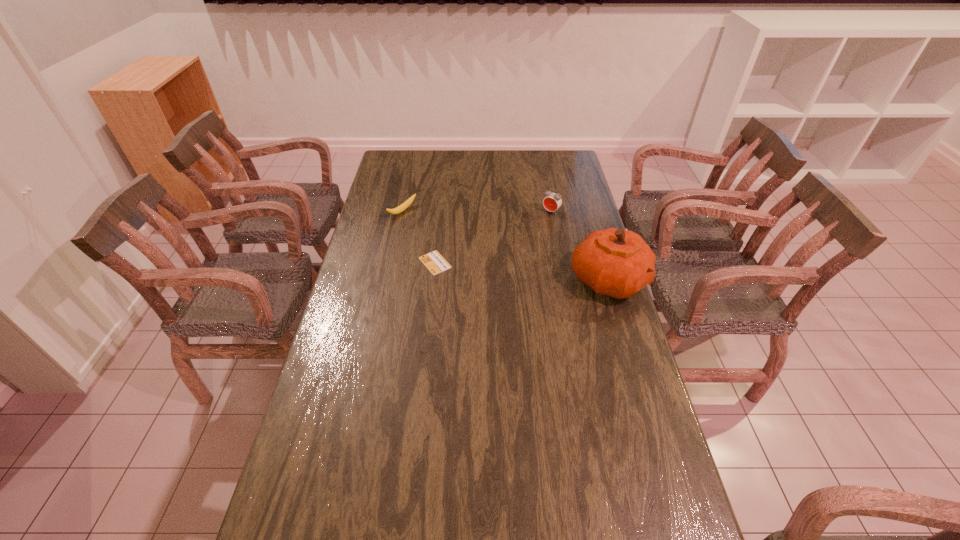
I want to click on object that is the closest one to the pumpkin, so click(x=552, y=201).

Locate an element on the screen. vacant area that satisfies the following two spatial constraints: 1. on the back side of the second object from left to right; 2. on the left side of the alarm clock is located at coordinates (441, 212).

Locate an element on the screen. This screenshot has height=540, width=960. vacant area in the image that satisfies the following two spatial constraints: 1. on the front side of the leftmost object; 2. on the front-facing side of the pumpkin is located at coordinates (387, 280).

At what (x,y) coordinates should I click in order to perform the action: click on vacant space that satisfies the following two spatial constraints: 1. on the front side of the pumpkin; 2. on the front-facing side of the banana. Please return your answer as a coordinate pair (x, y). The image size is (960, 540). Looking at the image, I should click on tap(387, 280).

Locate an element on the screen. free space in the image that satisfies the following two spatial constraints: 1. on the front side of the identity card; 2. on the right side of the leftmost object is located at coordinates (391, 263).

Locate an element on the screen. The width and height of the screenshot is (960, 540). vacant space that satisfies the following two spatial constraints: 1. on the front side of the banana; 2. on the right side of the identity card is located at coordinates (391, 263).

Where is `free space that satisfies the following two spatial constraints: 1. on the front side of the second shortest object; 2. on the front-facing side of the tallest object`? This screenshot has height=540, width=960. free space that satisfies the following two spatial constraints: 1. on the front side of the second shortest object; 2. on the front-facing side of the tallest object is located at coordinates (387, 280).